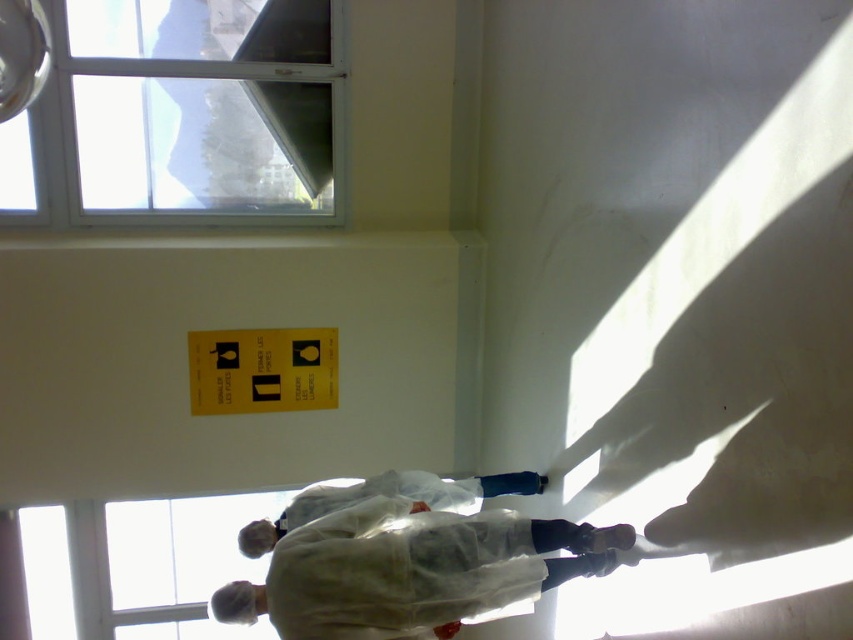
Question: Is transparent glass window at upper left closer to camera compared to white matte lab coat at center?

Choices:
 (A) yes
 (B) no

Answer: (B)

Question: Is transparent glass window at upper left to the left of white matte lab coat at center from the viewer's perspective?

Choices:
 (A) no
 (B) yes

Answer: (B)

Question: Is transparent glass window at upper left below white matte lab coat at center?

Choices:
 (A) yes
 (B) no

Answer: (B)

Question: Among these objects, which one is farthest from the camera?

Choices:
 (A) white matte lab coat at center
 (B) transparent glass window at upper left

Answer: (B)

Question: Which point appears farthest from the camera in this image?

Choices:
 (A) (122, 16)
 (B) (335, 564)

Answer: (A)